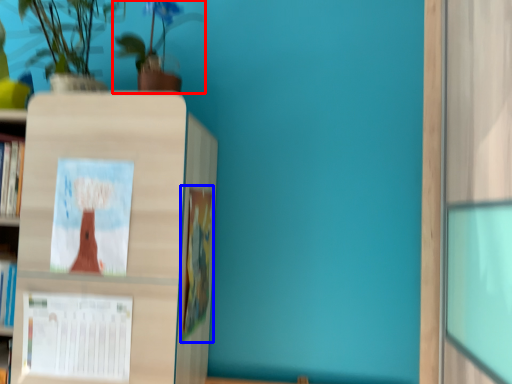
Question: Among these objects, which one is nearest to the camera, houseplant (highlighted by a red box) or book (highlighted by a blue box)?

Choices:
 (A) houseplant
 (B) book

Answer: (A)